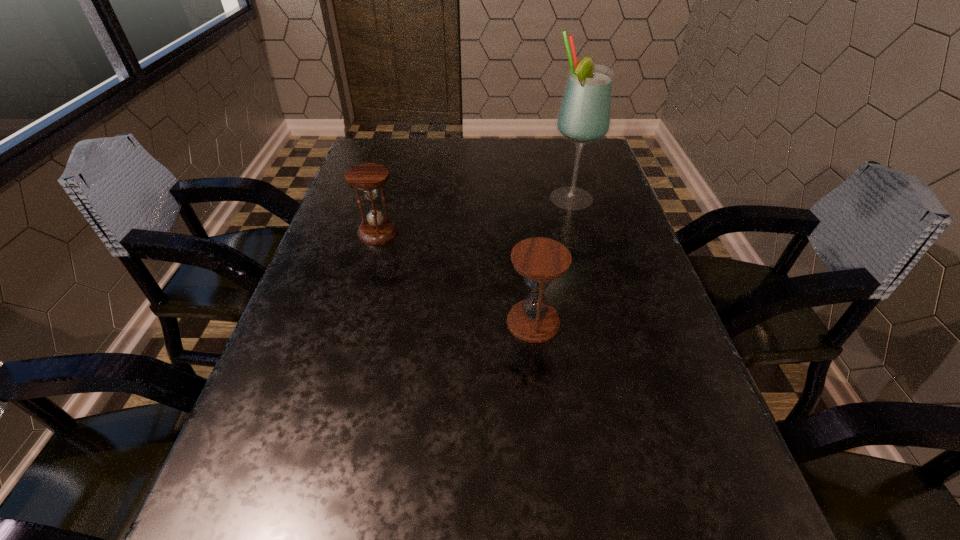
Locate an element on the screen. This screenshot has height=540, width=960. free space between the right hourglass and the left hourglass is located at coordinates (456, 277).

Where is `free space between the nearest object and the second farthest object`? This screenshot has width=960, height=540. free space between the nearest object and the second farthest object is located at coordinates (456, 277).

The width and height of the screenshot is (960, 540). In order to click on unoccupied position between the tallest object and the farther hourglass in this screenshot , I will do `click(474, 216)`.

The image size is (960, 540). I want to click on free spot between the second farthest object and the farthest object, so click(x=474, y=216).

Choose which object is the nearest neighbor to the second nearest object. Please provide its 2D coordinates. Your answer should be formatted as a tuple, i.e. [(x, y)], where the tuple contains the x and y coordinates of a point satisfying the conditions above.

[(539, 260)]

What are the coordinates of `object that is the nearest to the nearer hourglass` in the screenshot? It's located at (584, 116).

Image resolution: width=960 pixels, height=540 pixels. In order to click on vacant area that satisfies the following two spatial constraints: 1. on the back side of the farthest object; 2. on the left side of the nearer hourglass in this screenshot , I will do `click(519, 200)`.

Where is `vacant area in the image that satisfies the following two spatial constraints: 1. on the front side of the nearest object; 2. on the right side of the left hourglass`? vacant area in the image that satisfies the following two spatial constraints: 1. on the front side of the nearest object; 2. on the right side of the left hourglass is located at coordinates (353, 322).

Locate an element on the screen. The image size is (960, 540). blank area in the image that satisfies the following two spatial constraints: 1. on the back side of the alcohol; 2. on the left side of the nearest object is located at coordinates (519, 200).

I want to click on vacant space that satisfies the following two spatial constraints: 1. on the front side of the left hourglass; 2. on the left side of the right hourglass, so click(353, 322).